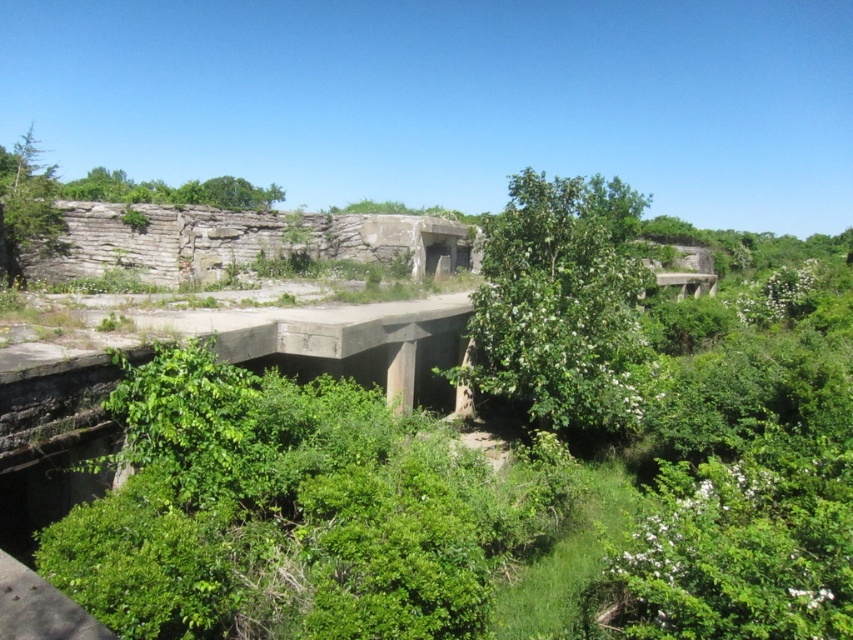
Question: Considering the relative positions of green leafy tree at center and green leafy tree at upper center in the image provided, where is green leafy tree at center located with respect to green leafy tree at upper center?

Choices:
 (A) left
 (B) right

Answer: (B)

Question: Which point is closer to the camera?

Choices:
 (A) (572, 278)
 (B) (93, 186)

Answer: (A)

Question: Can you confirm if green leafy tree at center is positioned above green leafy tree at upper center?

Choices:
 (A) yes
 (B) no

Answer: (B)

Question: Is green leafy tree at center bigger than green leafy tree at upper center?

Choices:
 (A) yes
 (B) no

Answer: (B)